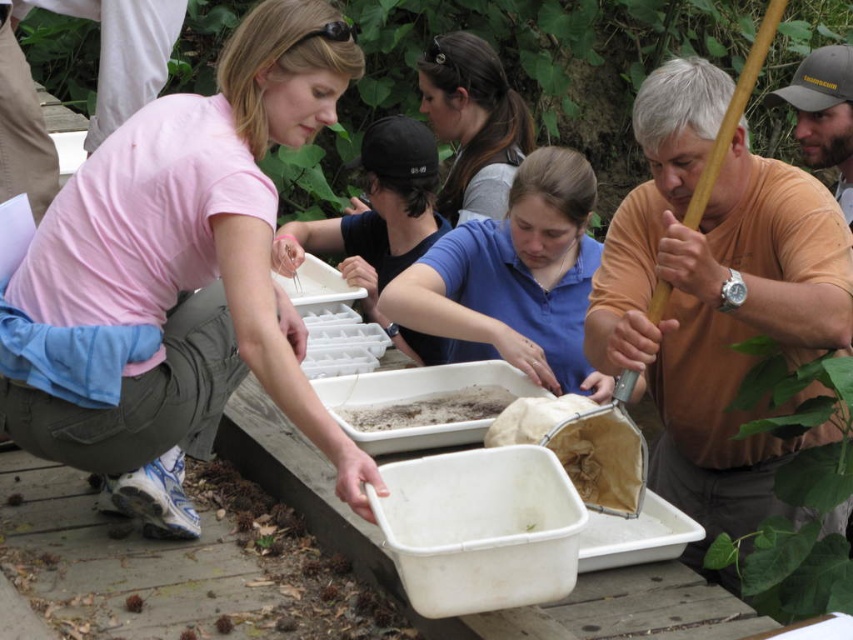
You are a participant in this outdoor activity and need to place a small label next to the tallest object between the green leafy plant at right and the smooth brown hair at center. Which object should you place the label on?

The smooth brown hair at center is taller than the green leafy plant at right, so the label should be placed on the smooth brown hair at center.

Looking at this image, you are standing at the wooden table in the scene. There is a point marked at coordinates (473, 122). What is this point located on?

The point at (473, 122) is located on smooth brown hair at center.

You are standing at point A located at coordinates point A at (535, 198). You need to walk to point B, which is 3.51 meters away. Is this distance within a typical walking distance for a short stroll?

Yes, 3.51 meters is a typical walking distance for a short stroll.